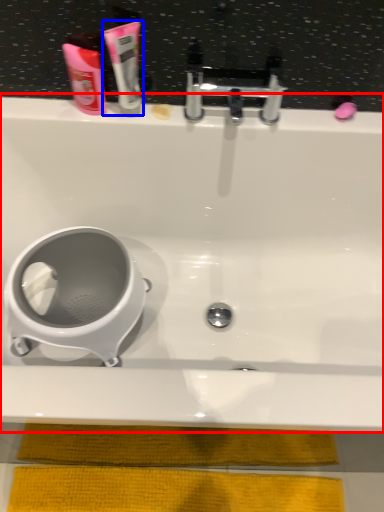
Question: Which point is further to the camera, bathtub (highlighted by a red box) or toothpaste (highlighted by a blue box)?

Choices:
 (A) bathtub
 (B) toothpaste

Answer: (B)